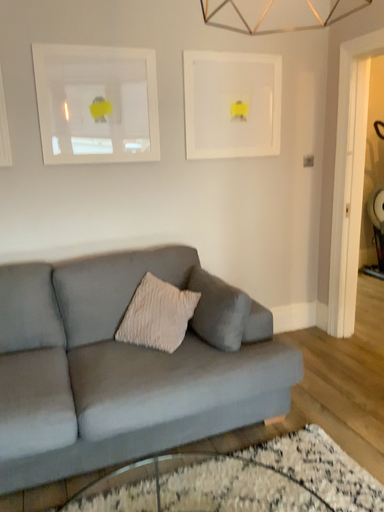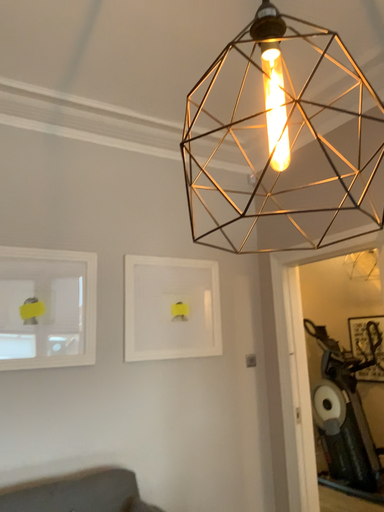
Question: Which way did the camera rotate in the video?

Choices:
 (A) rotated left
 (B) rotated right

Answer: (B)